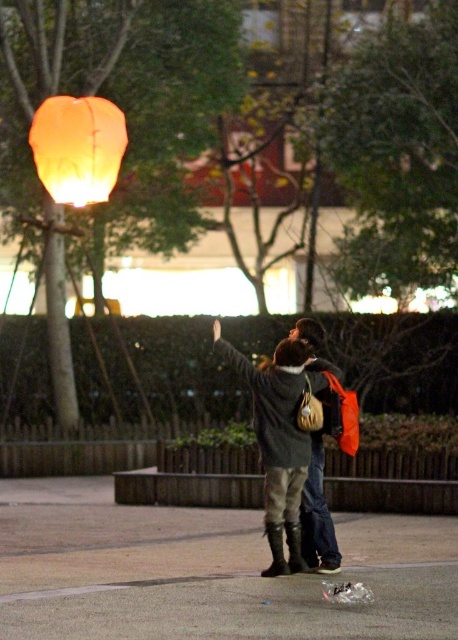
You are standing in the scene and want to hand a gift to the person wearing the leather jacket at center. However, there is a glowing matte orange lantern at upper left in your path. Based on their positions, can you reach the person without moving the lantern?

The leather jacket at center is located below the matte orange lantern at upper left, so you can reach the person by moving around the lantern since it is above them.